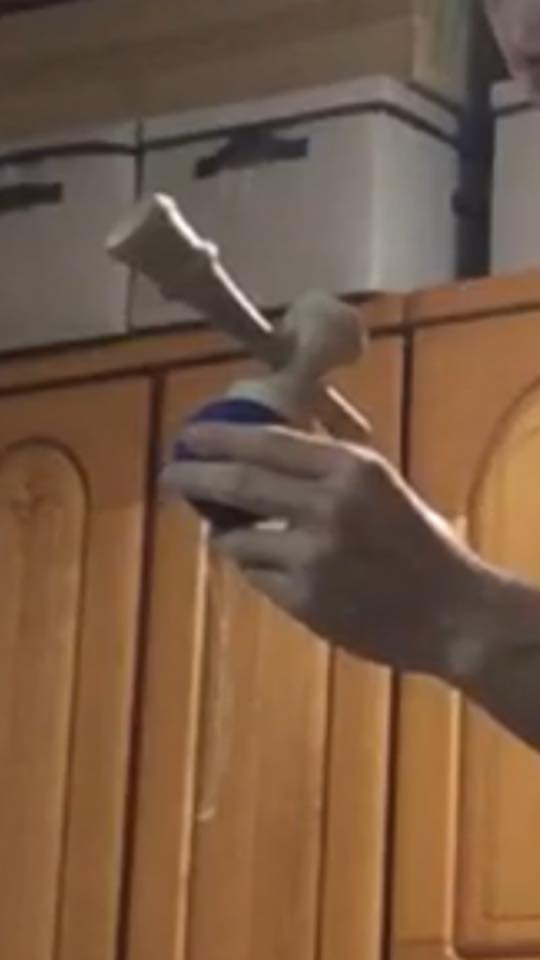
Find the location of a particular element. This screenshot has height=960, width=540. handle is located at coordinates (335, 333).